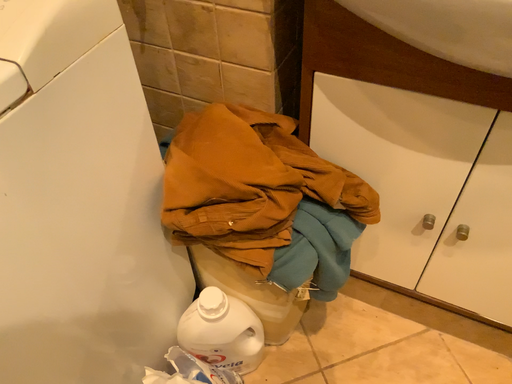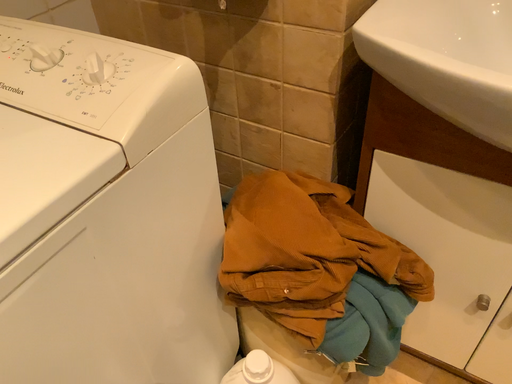
Question: How did the camera likely rotate when shooting the video?

Choices:
 (A) rotated upward
 (B) rotated downward

Answer: (A)